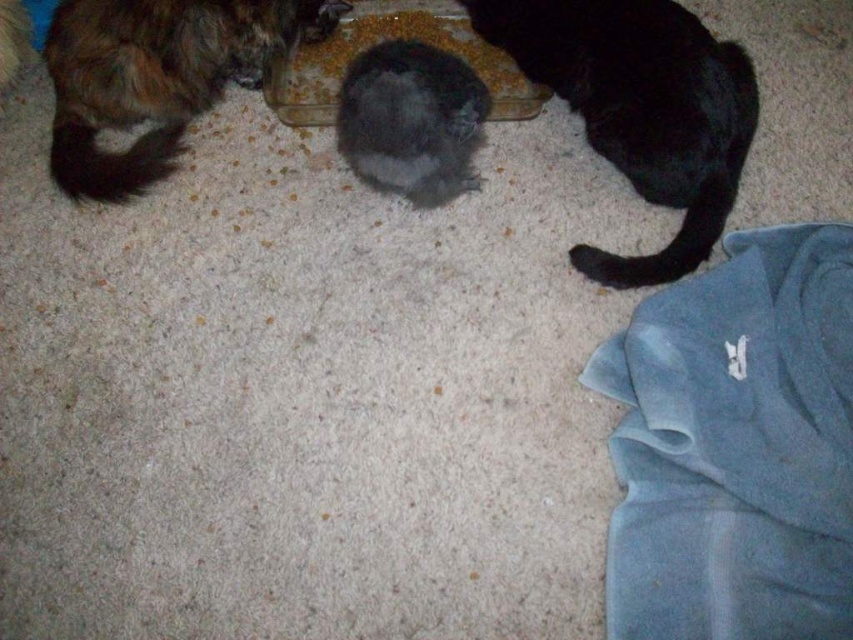
Does point (694, 40) lie behind point (384, 4)?

No, it is not.

How much distance is there between black fur cat at right and smooth plastic bowl at center?

black fur cat at right is 8.78 inches from smooth plastic bowl at center.

Locate an element on the screen. This screenshot has width=853, height=640. black fur cat at right is located at coordinates (640, 109).

In the scene shown: Who is positioned more to the right, shaggy brown fur cat at upper left or fluffy black cat at center?

From the viewer's perspective, fluffy black cat at center appears more on the right side.

Which is behind, point (102, 125) or point (436, 58)?

The point (436, 58) is behind.

The image size is (853, 640). I want to click on shaggy brown fur cat at upper left, so click(x=155, y=76).

Is black fur cat at right above fluffy black cat at center?

Correct, black fur cat at right is located above fluffy black cat at center.

Does black fur cat at right have a greater width compared to fluffy black cat at center?

Yes.

Is point (683, 232) more distant than point (393, 67)?

No, it is in front of (393, 67).

I want to click on black fur cat at right, so click(x=640, y=109).